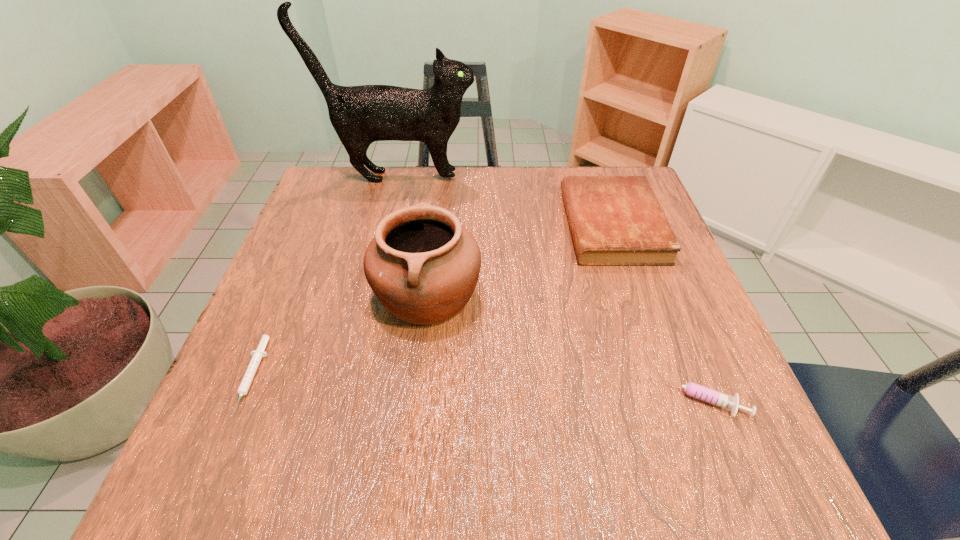
The image size is (960, 540). Find the location of `syringe positioned at the right edge`. syringe positioned at the right edge is located at coordinates (694, 390).

What are the coordinates of `object at the far left corner` in the screenshot? It's located at (360, 115).

Locate an element on the screen. This screenshot has height=540, width=960. object present at the far right corner is located at coordinates pos(614,220).

What are the coordinates of `vacant space at the far edge of the desktop` in the screenshot? It's located at (428, 197).

Find the location of a particular element. vacant space at the near edge of the desktop is located at coordinates (490, 467).

In the image, there is a desktop. Where is `vacant region at the left edge`? vacant region at the left edge is located at coordinates point(309,410).

I want to click on vacant space at the right edge of the desktop, so click(667, 348).

In the image, there is a desktop. Where is `vacant space at the far left corner`? Image resolution: width=960 pixels, height=540 pixels. vacant space at the far left corner is located at coordinates (353, 188).

You are a GUI agent. You are given a task and a screenshot of the screen. Output one action in this format:
    pyautogui.click(x=<x>, y=<y>)
    Task: Click on the blank space at the far right corner
    Image resolution: width=960 pixels, height=540 pixels.
    Given the screenshot: What is the action you would take?
    pyautogui.click(x=593, y=174)

Identify the location of vacant area at the near right corner of the desktop. (712, 438).